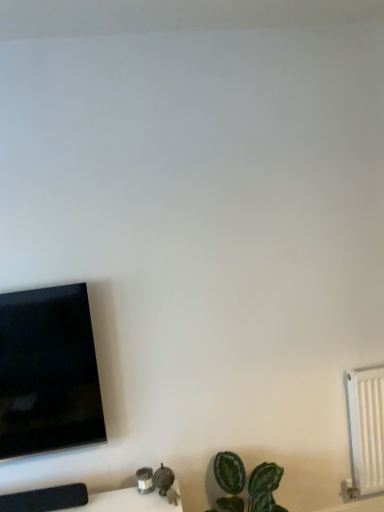
Question: From a real-world perspective, is white plastic radiator at right over black glossy tv at left?

Choices:
 (A) no
 (B) yes

Answer: (A)

Question: Is white plastic radiator at right located outside black glossy tv at left?

Choices:
 (A) yes
 (B) no

Answer: (A)

Question: From a real-world perspective, is white plastic radiator at right beneath black glossy tv at left?

Choices:
 (A) no
 (B) yes

Answer: (B)

Question: From the image's perspective, is white plastic radiator at right located beneath black glossy tv at left?

Choices:
 (A) yes
 (B) no

Answer: (A)

Question: Can you confirm if white plastic radiator at right is positioned to the left of black glossy tv at left?

Choices:
 (A) yes
 (B) no

Answer: (B)

Question: Considering the relative sizes of white plastic radiator at right and black glossy tv at left in the image provided, is white plastic radiator at right taller than black glossy tv at left?

Choices:
 (A) yes
 (B) no

Answer: (B)

Question: Is black glossy tv at left smaller than white plastic radiator at right?

Choices:
 (A) yes
 (B) no

Answer: (B)

Question: Is black glossy tv at left bigger than white plastic radiator at right?

Choices:
 (A) yes
 (B) no

Answer: (A)

Question: Is there a large distance between black glossy tv at left and white plastic radiator at right?

Choices:
 (A) yes
 (B) no

Answer: (A)

Question: From the image's perspective, is black glossy tv at left on white plastic radiator at right?

Choices:
 (A) no
 (B) yes

Answer: (B)

Question: Is black glossy tv at left shorter than white plastic radiator at right?

Choices:
 (A) yes
 (B) no

Answer: (B)

Question: Is black glossy tv at left positioned in front of white plastic radiator at right?

Choices:
 (A) no
 (B) yes

Answer: (B)

Question: Is white plastic radiator at right to the left or to the right of black glossy tv at left in the image?

Choices:
 (A) left
 (B) right

Answer: (B)